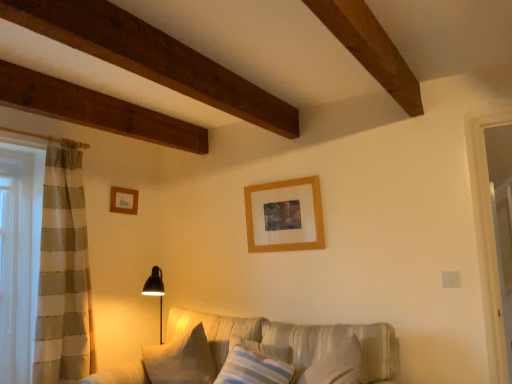
Question: From a real-world perspective, is textured beige couch at center physically above white soft pillow at lower center, placed as the first pillow when sorted from left to right?

Choices:
 (A) yes
 (B) no

Answer: (B)

Question: Does textured beige couch at center have a lesser height compared to white soft pillow at lower center, placed as the first pillow when sorted from left to right?

Choices:
 (A) yes
 (B) no

Answer: (B)

Question: Considering the relative sizes of textured beige couch at center and white soft pillow at lower center, which is the 2th pillow from right to left, in the image provided, is textured beige couch at center smaller than white soft pillow at lower center, which is the 2th pillow from right to left,?

Choices:
 (A) no
 (B) yes

Answer: (A)

Question: From a real-world perspective, does textured beige couch at center sit lower than white soft pillow at lower center, placed as the first pillow when sorted from left to right?

Choices:
 (A) no
 (B) yes

Answer: (B)

Question: Is textured beige couch at center not near white soft pillow at lower center, which is the 2th pillow from right to left?

Choices:
 (A) yes
 (B) no

Answer: (B)

Question: From a real-world perspective, is white soft pillow at lower center, placed as the first pillow when sorted from left to right, above or below wooden picture frame at upper left, which is counted as the first picture frame, starting from the left?

Choices:
 (A) above
 (B) below

Answer: (B)

Question: Looking at the image, does white soft pillow at lower center, which is the 2th pillow from right to left, seem bigger or smaller compared to wooden picture frame at upper left, placed as the 2th picture frame when sorted from front to back?

Choices:
 (A) small
 (B) big

Answer: (B)

Question: Based on their positions, is white soft pillow at lower center, which is the 2th pillow from right to left, located to the left or right of wooden picture frame at upper left, which ranks as the first picture frame in back-to-front order?

Choices:
 (A) right
 (B) left

Answer: (A)

Question: Is white soft pillow at lower center, placed as the first pillow when sorted from left to right, wider or thinner than wooden picture frame at upper left, which is counted as the first picture frame, starting from the left?

Choices:
 (A) thin
 (B) wide

Answer: (B)

Question: Is textured beige couch at center wider or thinner than striped fabric pillow at center, the second pillow in the left-to-right sequence?

Choices:
 (A) wide
 (B) thin

Answer: (A)

Question: Looking at the image, does textured beige couch at center seem bigger or smaller compared to striped fabric pillow at center, which is the 1th pillow in right-to-left order?

Choices:
 (A) small
 (B) big

Answer: (B)

Question: Considering the positions of point (211, 319) and point (222, 382), is point (211, 319) closer or farther from the camera than point (222, 382)?

Choices:
 (A) farther
 (B) closer

Answer: (A)

Question: From the image's perspective, relative to striped fabric pillow at center, the second pillow in the left-to-right sequence, is textured beige couch at center above or below?

Choices:
 (A) above
 (B) below

Answer: (B)

Question: In the image, is textured beige couch at center positioned in front of or behind white soft pillow at lower center, which is the 2th pillow from right to left?

Choices:
 (A) front
 (B) behind

Answer: (A)

Question: Does point (251, 332) appear closer or farther from the camera than point (210, 375)?

Choices:
 (A) closer
 (B) farther

Answer: (B)